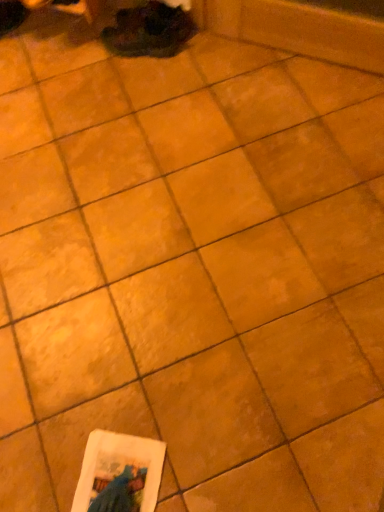
What do you see at coordinates (148, 30) in the screenshot? The image size is (384, 512). I see `dark brown leather shoes at upper left` at bounding box center [148, 30].

Identify the location of dark brown leather shoes at upper left. (148, 30).

You are a GUI agent. You are given a task and a screenshot of the screen. Output one action in this format:
    pyautogui.click(x=<x>, y=<y>)
    Task: Click on the dark brown leather shoes at upper left
    The width and height of the screenshot is (384, 512).
    Given the screenshot: What is the action you would take?
    pyautogui.click(x=148, y=30)